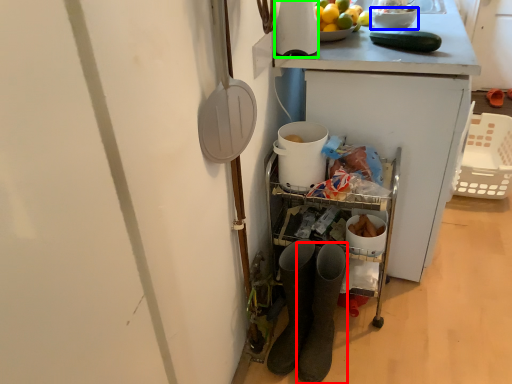
Question: Estimate the real-world distances between objects in this image. Which object is closer to footwear (highlighted by a red box), bowl (highlighted by a blue box) or appliance (highlighted by a green box)?

Choices:
 (A) bowl
 (B) appliance

Answer: (B)